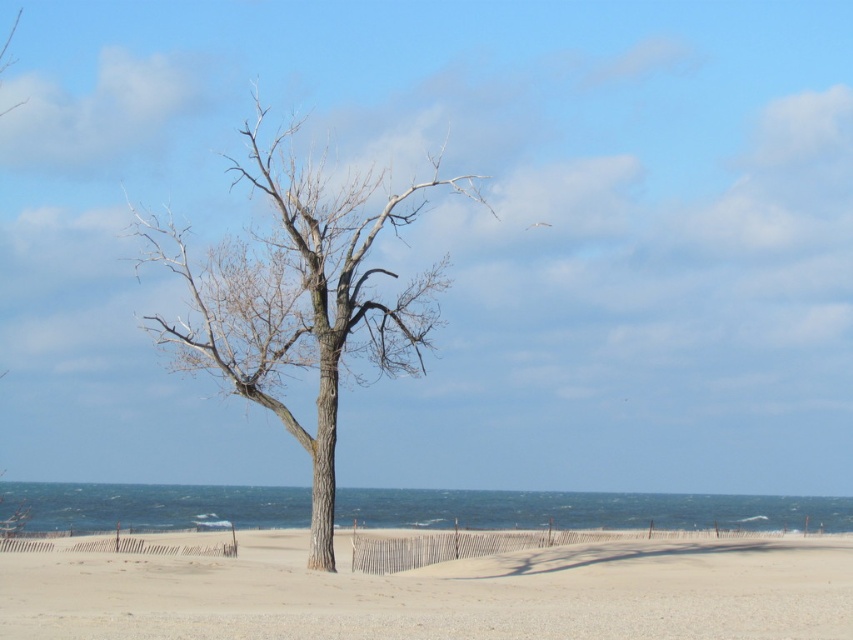
You are standing on the beach and want to walk from the smooth sand at center to the bare wood tree at center. Which direction should you face to move towards the tree?

You should face to the left to move towards the bare wood tree at center since the smooth sand at center is to the right of the tree.